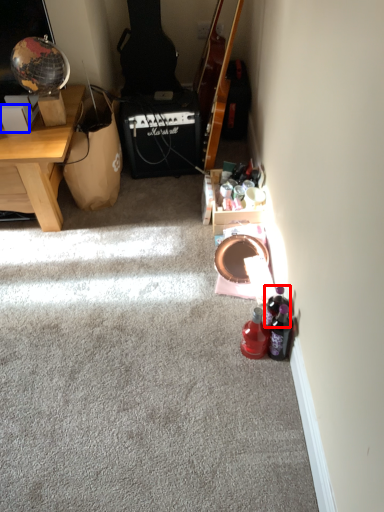
Question: Which point is closer to the camera, bottle (highlighted by a red box) or box (highlighted by a blue box)?

Choices:
 (A) bottle
 (B) box

Answer: (A)